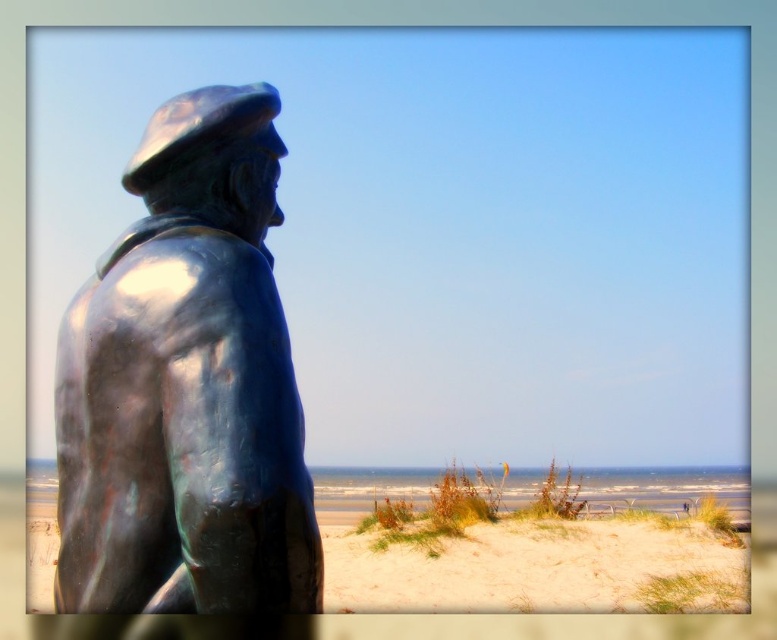
Can you confirm if bronze statue at left is smaller than sandy beige sand at lower right?

Indeed, bronze statue at left has a smaller size compared to sandy beige sand at lower right.

Is point (197, 344) positioned before point (577, 600)?

Yes, point (197, 344) is closer to viewer.

Does point (178, 605) lie behind point (340, 477)?

No.

Where is `bronze statue at left`? Image resolution: width=777 pixels, height=640 pixels. bronze statue at left is located at coordinates (186, 385).